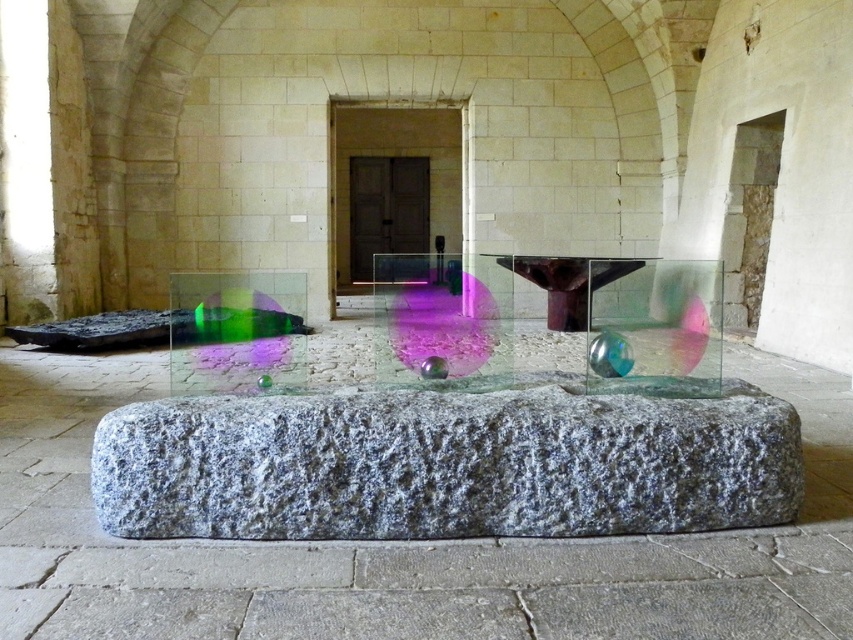
Measure the distance between point [248,397] and camera.

Point [248,397] is 10.06 feet from camera.

Is granite stone at center above transparent glass table at center?

No, granite stone at center is not above transparent glass table at center.

What do you see at coordinates (445, 465) in the screenshot? I see `granite stone at center` at bounding box center [445, 465].

Locate an element on the screen. This screenshot has width=853, height=640. granite stone at center is located at coordinates (445, 465).